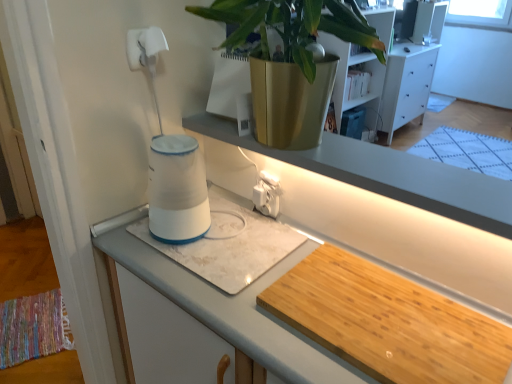
This screenshot has height=384, width=512. What are the coordinates of `free space underneath white glossy cup at center, placed as the 2th wide when sorted from right to left (from a real-world perspective)` in the screenshot? It's located at (236, 240).